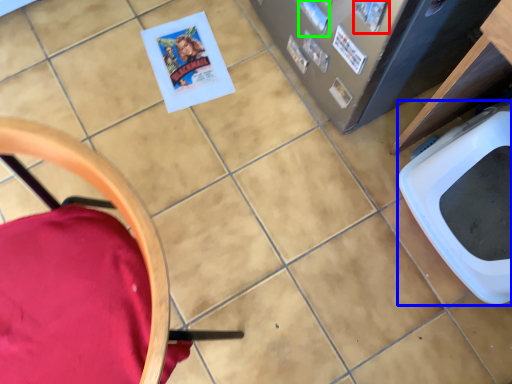
Question: Based on their relative distances, which object is farther from comic book (highlighted by a red box)? Choose from toilet bowl (highlighted by a blue box) and comic book (highlighted by a green box).

Choices:
 (A) toilet bowl
 (B) comic book

Answer: (A)